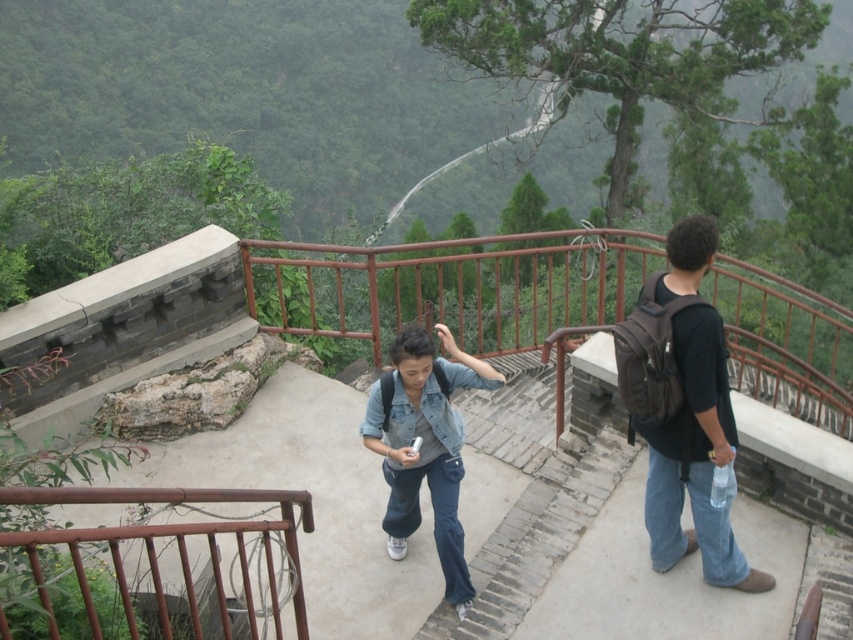
The height and width of the screenshot is (640, 853). I want to click on rusty metal railing at center, so click(451, 285).

Measure the distance between rusty metal railing at center and black backpack at right.

The distance of rusty metal railing at center from black backpack at right is 8.20 feet.

Does point (643, 248) lie in front of point (703, 312)?

No, (643, 248) is behind (703, 312).

At what (x,y) coordinates should I click in order to perform the action: click on rusty metal railing at center. Please return your answer as a coordinate pair (x, y). Looking at the image, I should click on pos(451,285).

Who is more forward, (624, 296) or (97, 502)?

Positioned in front is point (97, 502).

Which is behind, point (585, 300) or point (194, 525)?

Point (585, 300)

Image resolution: width=853 pixels, height=640 pixels. I want to click on rusty metal railing at center, so click(451, 285).

This screenshot has height=640, width=853. What do you see at coordinates (695, 458) in the screenshot? I see `black backpack at right` at bounding box center [695, 458].

Is black backpack at right further to the viewer compared to rusty metal railing at upper left?

Yes, it is behind rusty metal railing at upper left.

Describe the element at coordinates (695, 458) in the screenshot. This screenshot has height=640, width=853. I see `black backpack at right` at that location.

Identify the location of black backpack at right. The height and width of the screenshot is (640, 853). (695, 458).